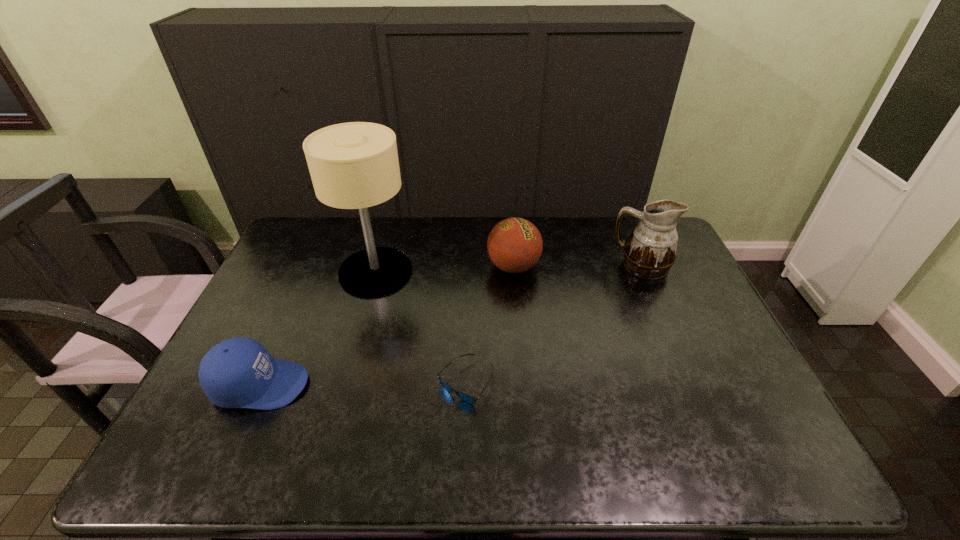
I want to click on blank space located 0.340m on the front of the basketball, so [523, 372].

At what (x,y) coordinates should I click in order to perform the action: click on vacant region located 0.130m on the front-facing side of the fourth tallest object. Please return your answer as a coordinate pair (x, y). This screenshot has height=540, width=960. Looking at the image, I should click on (359, 385).

I want to click on vacant position located at the front of the shortest object showing the lenses, so click(x=464, y=438).

What are the coordinates of `table lamp that is at the far edge` in the screenshot? It's located at (354, 165).

Where is `pitcher located at the far edge`? pitcher located at the far edge is located at coordinates (650, 251).

Where is `basketball located in the far edge section of the desktop`? The image size is (960, 540). basketball located in the far edge section of the desktop is located at coordinates (514, 245).

Locate an element on the screen. object that is at the left edge is located at coordinates (239, 372).

Identify the location of object located at the right edge. The height and width of the screenshot is (540, 960). (650, 251).

You are a GUI agent. You are given a task and a screenshot of the screen. Output one action in this format:
    pyautogui.click(x=<x>, y=<y>)
    Task: Click on the object at the far right corner
    Image resolution: width=960 pixels, height=540 pixels.
    Given the screenshot: What is the action you would take?
    pyautogui.click(x=650, y=251)

The height and width of the screenshot is (540, 960). I want to click on free space at the far edge of the desktop, so click(430, 224).